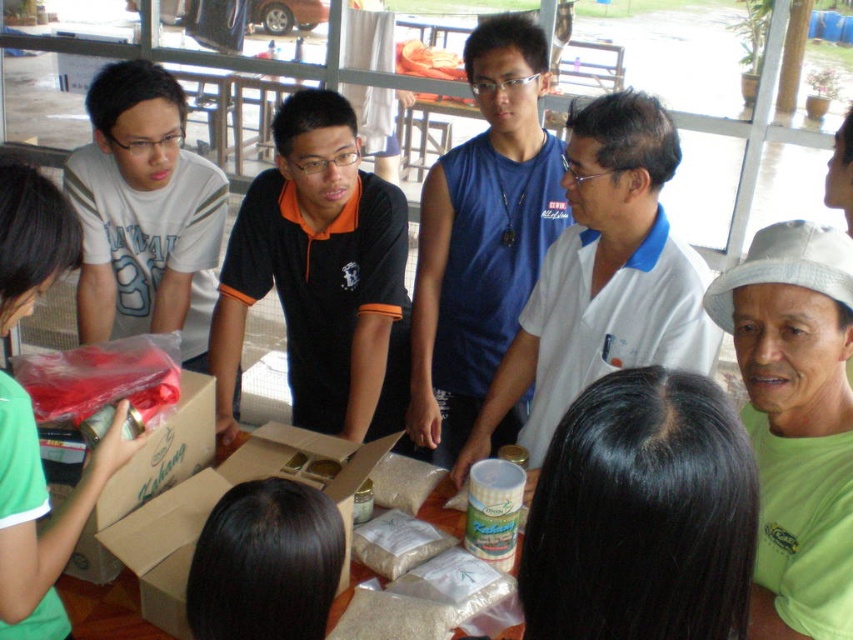
Question: Estimate the real-world distances between objects in this image. Which object is farther from the white cotton shirt at center?

Choices:
 (A) white matte shirt at upper left
 (B) black hair at lower center
 (C) brown paper bag at center
 (D) brown cardboard box at center

Answer: (A)

Question: Is blue sleeveless shirt at upper center thinner than black hair at lower center?

Choices:
 (A) yes
 (B) no

Answer: (B)

Question: Can you confirm if cardboard box at lower left is wider than brown paper bag at center?

Choices:
 (A) no
 (B) yes

Answer: (B)

Question: Among these objects, which one is nearest to the camera?

Choices:
 (A) white matte shirt at upper left
 (B) blue sleeveless shirt at upper center
 (C) white cotton shirt at center
 (D) brown cardboard box at center

Answer: (A)

Question: Is brown cardboard box at center below white matte bag at center?

Choices:
 (A) yes
 (B) no

Answer: (B)

Question: Considering the real-world distances, which object is closest to the black hair at lower center?

Choices:
 (A) white matte bag at center
 (B) brown paper bag at center
 (C) black hair at center

Answer: (C)